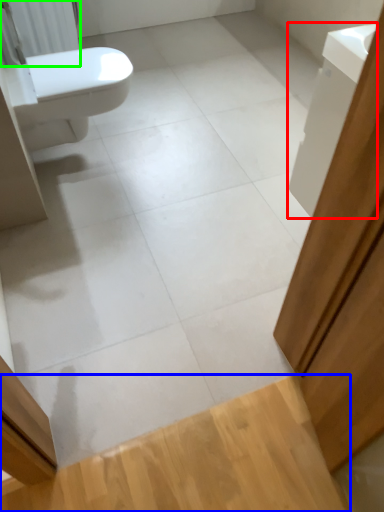
Question: Based on their relative distances, which object is farther from cabinetry (highlighted by a red box)? Choose from plank (highlighted by a blue box) and radiator (highlighted by a green box).

Choices:
 (A) plank
 (B) radiator

Answer: (B)